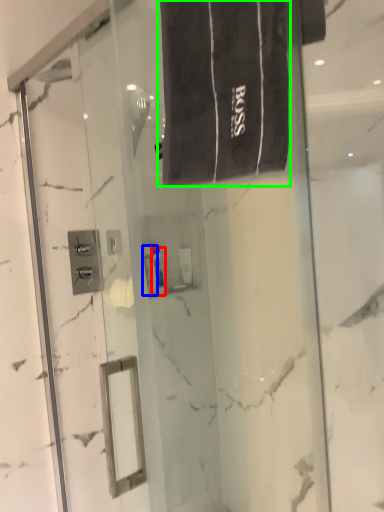
Question: Estimate the real-world distances between objects in this image. Which object is farther from toiletry (highlighted by a red box), toiletry (highlighted by a blue box) or bath towel (highlighted by a green box)?

Choices:
 (A) toiletry
 (B) bath towel

Answer: (B)